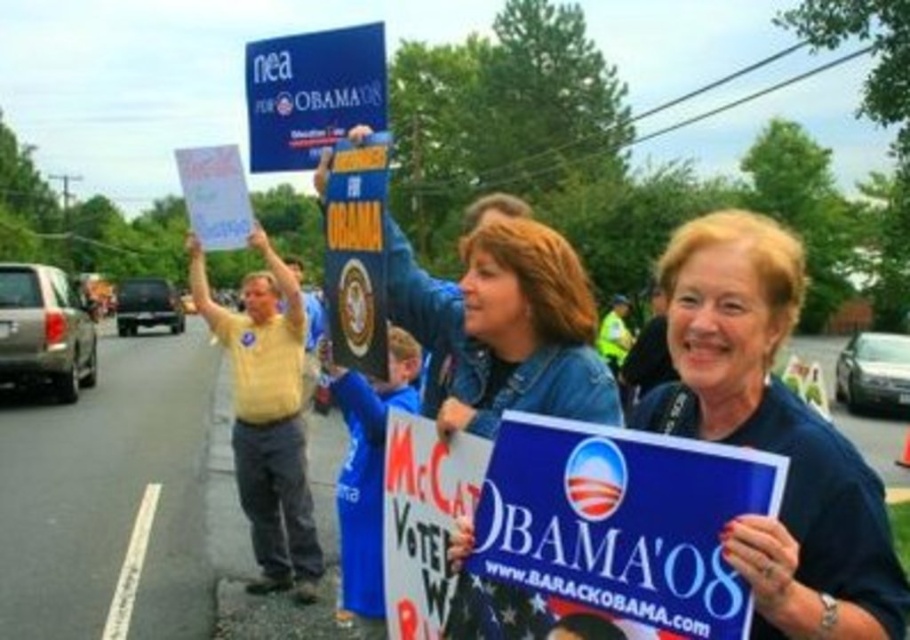
You are a photographer standing in the middle of the street at the rally. You want to take a picture of the blue fabric sign at center. Based on its position, where should you aim your camera relative to the other elements in the scene?

The blue fabric sign at center is located at point 0.680 on the x axis and 0.849 on the y axis, so you should aim your camera towards the center of the scene slightly to the right and upwards to capture it properly.

You are a photographer trying to capture the most detailed shot of the blue fabric sign at center and the blue plastic sign at upper center. Which sign should you focus on first to ensure it appears larger in your photo?

The blue fabric sign at center is closer to the viewer than the blue plastic sign at upper center, so focusing on it first will make it appear larger in the photo.